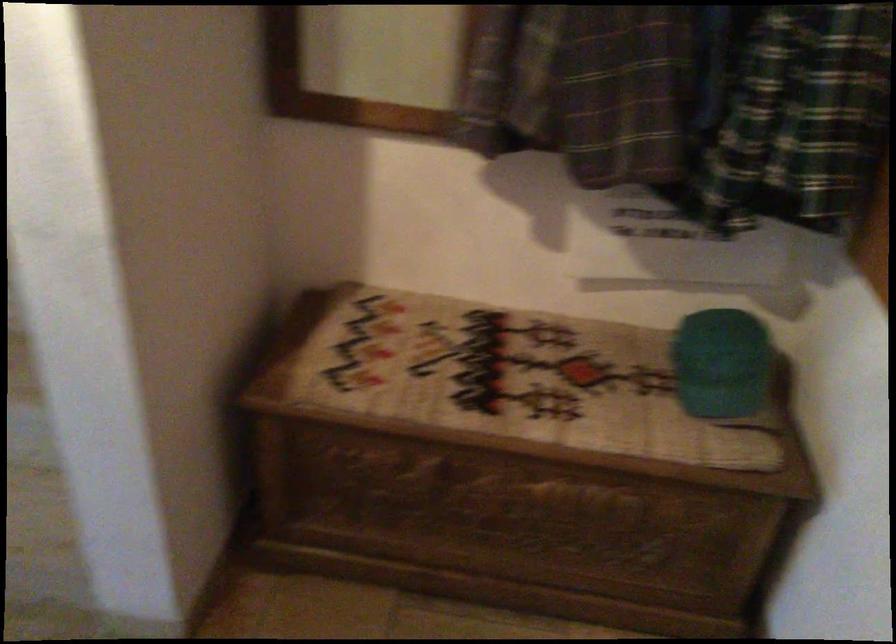
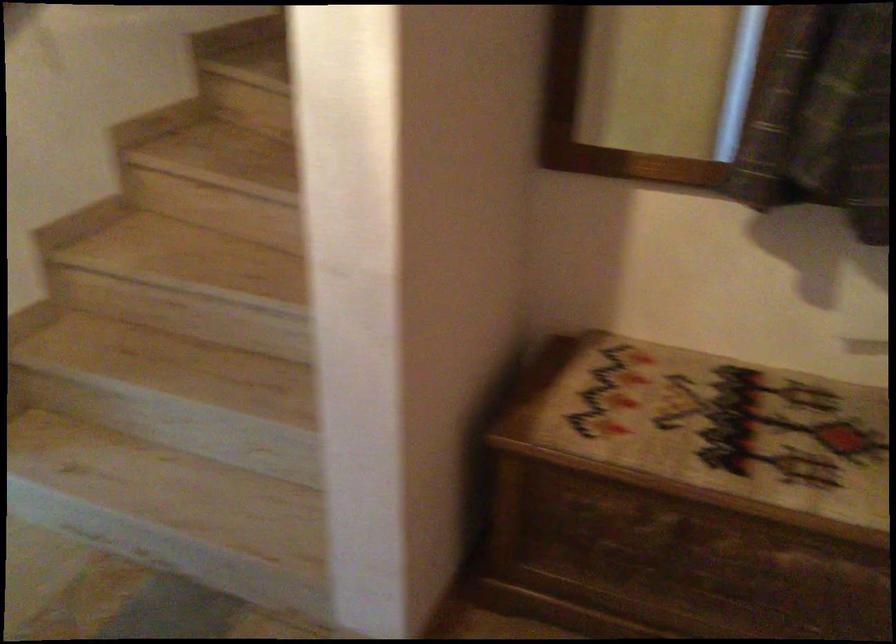
In the second image, find the point that corresponds to (x=462, y=375) in the first image.

(709, 431)